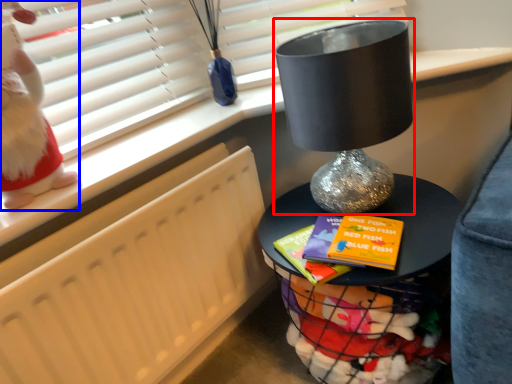
Question: Which object is further to the camera taking this photo, table lamp (highlighted by a red box) or doll (highlighted by a blue box)?

Choices:
 (A) table lamp
 (B) doll

Answer: (A)